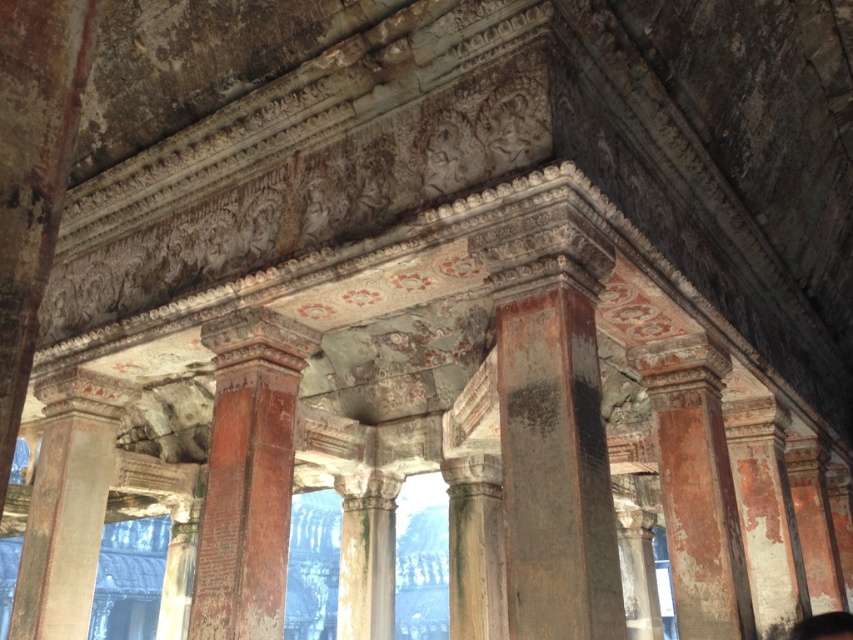
You are an architect examining the temple interior. You notice the rusty metal column at center and the rustic stone column at center. Which column has a larger size?

The rusty metal column at center is bigger than the rustic stone column at center, so the rusty metal column at center has a larger size.

You are standing at the entrance of the temple and want to locate the rusty metal column at center. According to the coordinates given, where should you look relative to your position?

The rusty metal column at center is located at coordinates point (248, 474), which means it is positioned to the right and slightly below your current viewpoint.